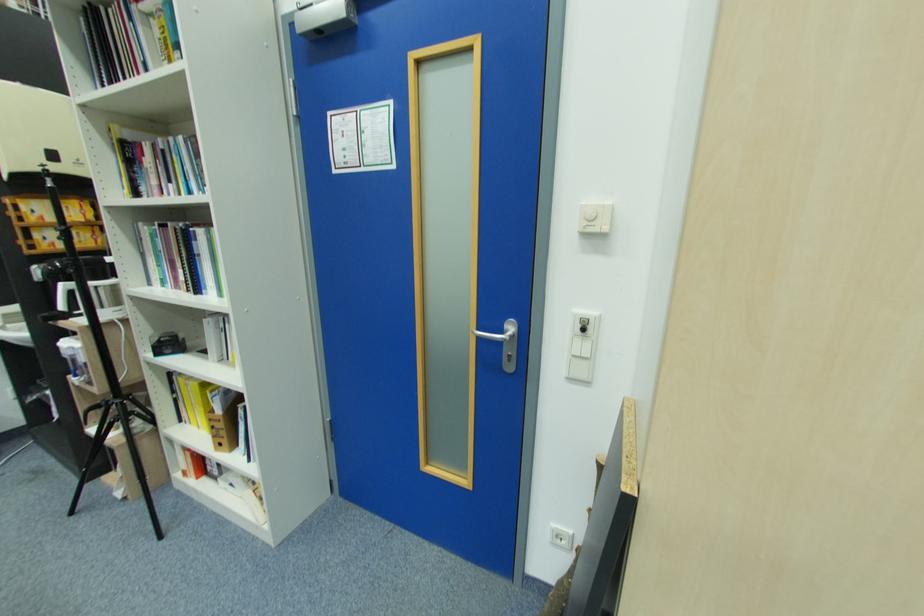
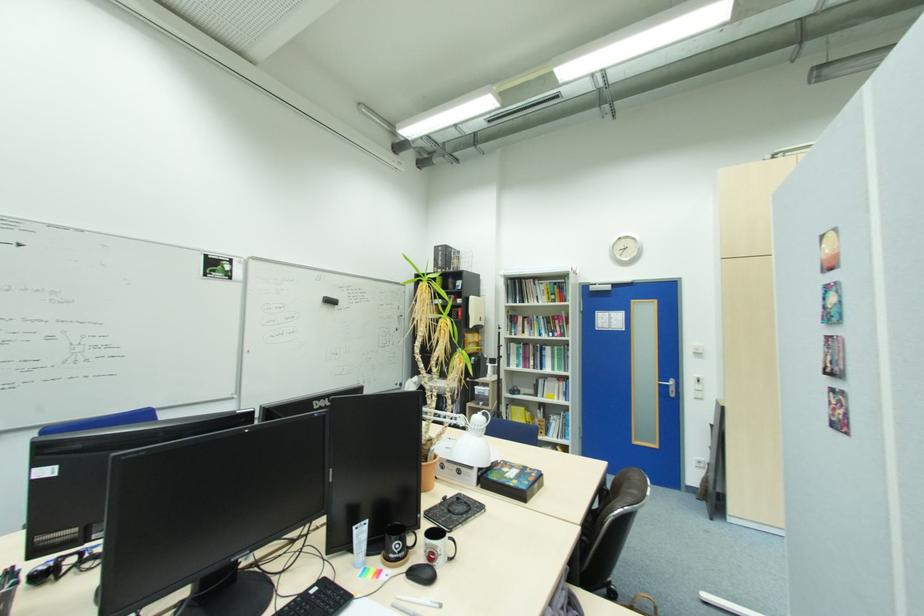
What movement of the cameraman would produce the second image?

The movement direction of the cameraman is left, backward.